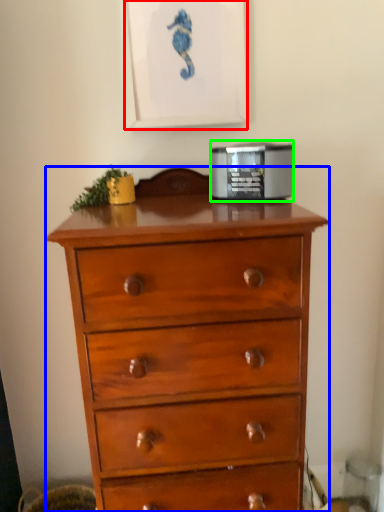
Question: Estimate the real-world distances between objects in this image. Which object is closer to picture frame (highlighted by a red box), chest of drawers (highlighted by a blue box) or appliance (highlighted by a green box)?

Choices:
 (A) chest of drawers
 (B) appliance

Answer: (B)